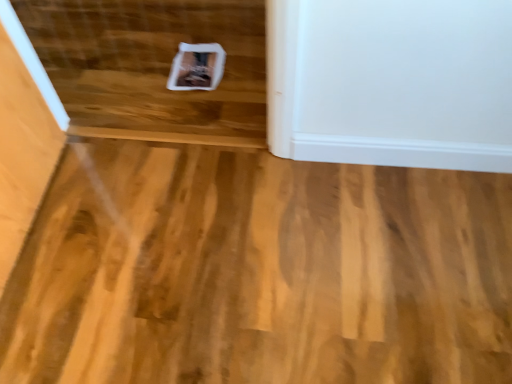
Question: Could you tell me if white paper at center is turned towards natural wood floor at center?

Choices:
 (A) no
 (B) yes

Answer: (B)

Question: Would you say natural wood floor at center is part of white paper at center's contents?

Choices:
 (A) yes
 (B) no

Answer: (B)

Question: From a real-world perspective, is white paper at center on top of natural wood floor at center?

Choices:
 (A) yes
 (B) no

Answer: (A)

Question: Does white paper at center have a larger size compared to natural wood floor at center?

Choices:
 (A) yes
 (B) no

Answer: (B)

Question: Does white paper at center lie behind natural wood floor at center?

Choices:
 (A) yes
 (B) no

Answer: (A)

Question: Does white paper at center lie in front of natural wood floor at center?

Choices:
 (A) yes
 (B) no

Answer: (B)

Question: From a real-world perspective, is natural wood floor at center beneath white paper at center?

Choices:
 (A) yes
 (B) no

Answer: (A)

Question: From the image's perspective, is natural wood floor at center beneath white paper at center?

Choices:
 (A) no
 (B) yes

Answer: (B)

Question: Is natural wood floor at center aimed at white paper at center?

Choices:
 (A) yes
 (B) no

Answer: (A)

Question: Would you consider natural wood floor at center to be distant from white paper at center?

Choices:
 (A) yes
 (B) no

Answer: (B)

Question: Is natural wood floor at center at the right side of white paper at center?

Choices:
 (A) no
 (B) yes

Answer: (B)

Question: Is natural wood floor at center touching white paper at center?

Choices:
 (A) no
 (B) yes

Answer: (A)

Question: Considering the positions of natural wood floor at center and white paper at center in the image, is natural wood floor at center wider or thinner than white paper at center?

Choices:
 (A) thin
 (B) wide

Answer: (A)